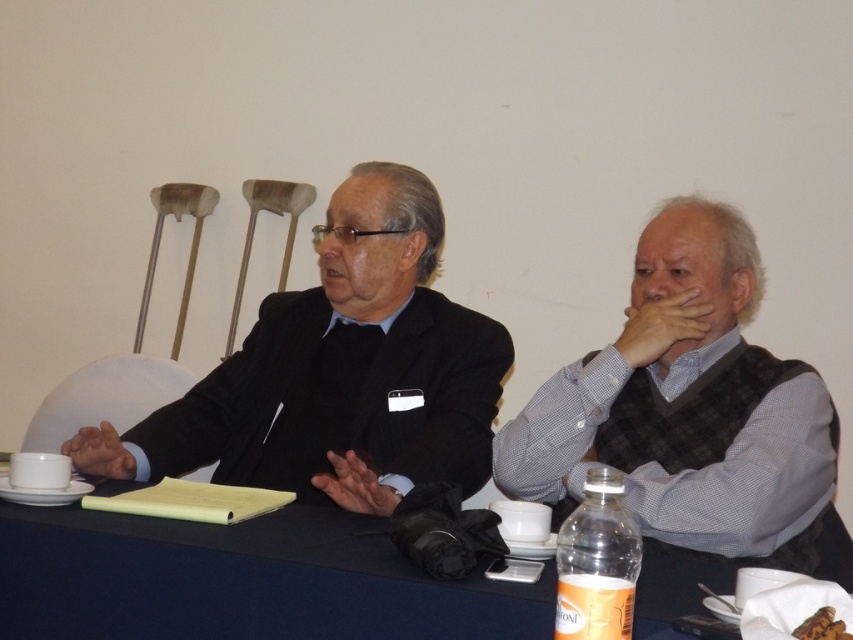
Does blue fabric table at center have a lesser width compared to clear plastic bottle at lower right?

In fact, blue fabric table at center might be wider than clear plastic bottle at lower right.

Which is more to the right, blue fabric table at center or clear plastic bottle at lower right?

clear plastic bottle at lower right is more to the right.

Identify the location of blue fabric table at center. This screenshot has width=853, height=640. (241, 580).

Who is higher up, gray checkered vest at right or blue fabric table at center?

gray checkered vest at right is higher up.

How far apart are gray checkered vest at right and blue fabric table at center?

gray checkered vest at right is 18.64 inches away from blue fabric table at center.

Is point (660, 506) positioned before point (453, 627)?

No.

Find the location of a particular element. gray checkered vest at right is located at coordinates (692, 412).

Can you confirm if matte black suit at center is smaller than gray checkered vest at right?

Actually, matte black suit at center might be larger than gray checkered vest at right.

Consider the image. Who is more distant from viewer, (379, 214) or (691, 532)?

Point (379, 214)

The image size is (853, 640). What do you see at coordinates (338, 371) in the screenshot?
I see `matte black suit at center` at bounding box center [338, 371].

This screenshot has height=640, width=853. I want to click on matte black suit at center, so click(338, 371).